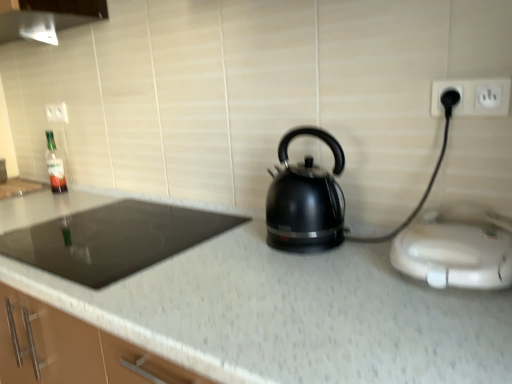
Question: From a real-world perspective, is white plastic toaster at right above or below white plastic electric outlet at upper center, which is the second electric outlet in bottom-to-top order?

Choices:
 (A) below
 (B) above

Answer: (A)

Question: Relative to white plastic electric outlet at upper center, which is counted as the 2th electric outlet, starting from the front, is white plastic toaster at right in front or behind?

Choices:
 (A) behind
 (B) front

Answer: (B)

Question: Which of these objects is positioned closest to the black glossy kettle at center?

Choices:
 (A) black glass cooktop at left
 (B) black plastic electric outlet at upper right, which appears as the 2th electric outlet when viewed from the top
 (C) white plastic toaster at right
 (D) translucent glass bottle at left
 (E) white plastic electric outlet at upper center, which is counted as the 2th electric outlet, starting from the front

Answer: (C)

Question: Considering the real-world distances, which object is closest to the white plastic toaster at right?

Choices:
 (A) black glass cooktop at left
 (B) black plastic electric outlet at upper right, which appears as the 2th electric outlet when viewed from the top
 (C) black glossy kettle at center
 (D) translucent glass bottle at left
 (E) white plastic electric outlet at upper center, the first electric outlet from the back

Answer: (C)